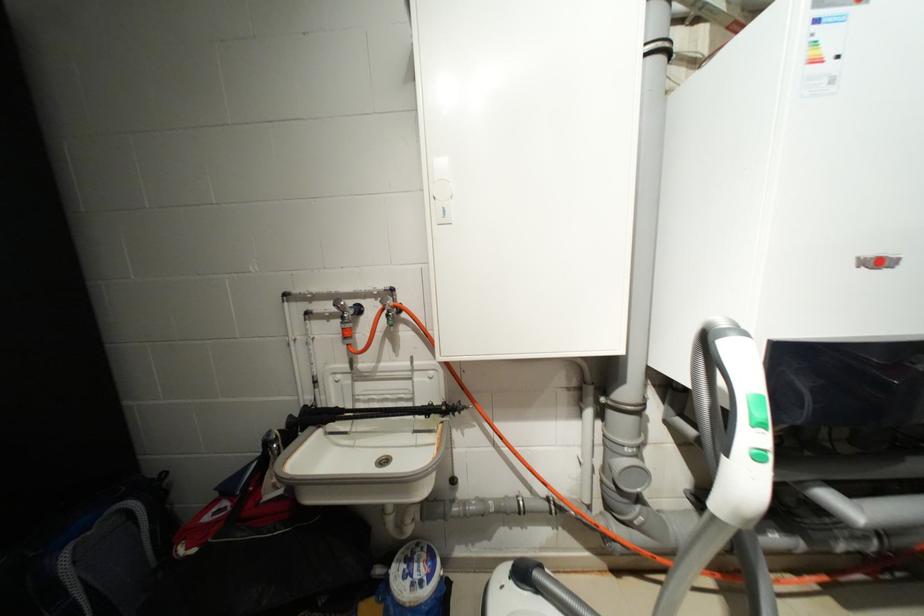
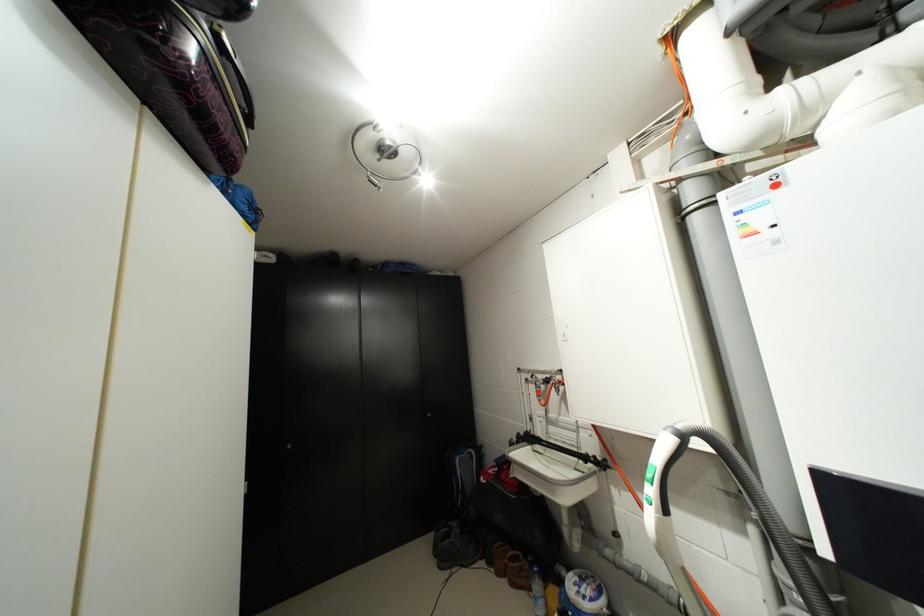
Question: How did the camera likely rotate?

Choices:
 (A) Left
 (B) Right
 (C) Up
 (D) Down

Answer: (A)